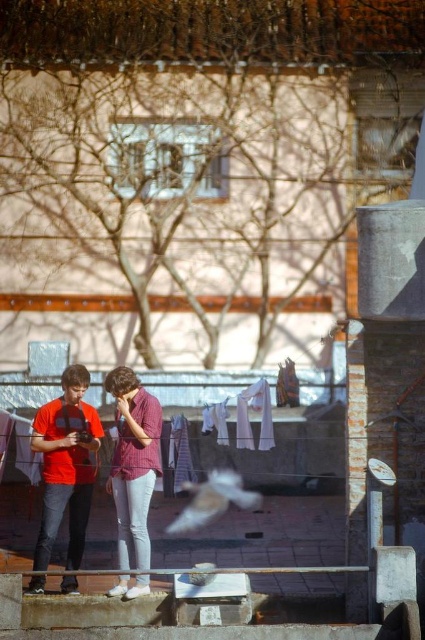
Question: Among these points, which one is farthest from the camera?

Choices:
 (A) (51, 461)
 (B) (251, 502)

Answer: (B)

Question: Estimate the real-world distances between objects in this image. Which object is farther from the matte red shirt at center?

Choices:
 (A) matte red t-shirt at left
 (B) white feathered bird at center

Answer: (B)

Question: Can you confirm if matte red t-shirt at left is wider than white feathered bird at center?

Choices:
 (A) yes
 (B) no

Answer: (B)

Question: Does matte red t-shirt at left appear on the right side of white feathered bird at center?

Choices:
 (A) yes
 (B) no

Answer: (B)

Question: Which object is farther from the camera taking this photo?

Choices:
 (A) white feathered bird at center
 (B) matte red shirt at center

Answer: (A)

Question: Can you confirm if matte red shirt at center is positioned to the left of white feathered bird at center?

Choices:
 (A) no
 (B) yes

Answer: (B)